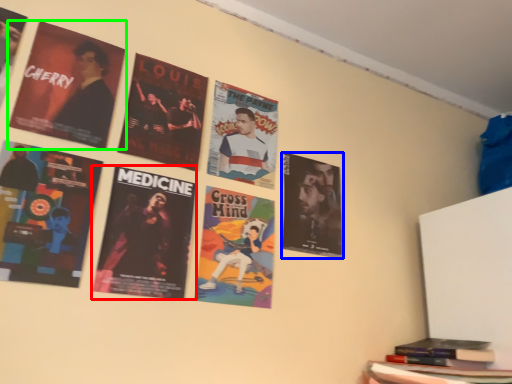
Question: Based on their relative distances, which object is nearer to poster (highlighted by a red box)? Choose from poster (highlighted by a blue box) and poster (highlighted by a green box).

Choices:
 (A) poster
 (B) poster

Answer: (B)